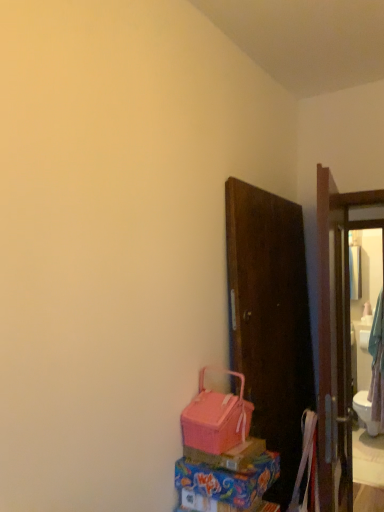
Measure the distance between point (246, 469) and camera.

Point (246, 469) is 4.40 feet away from camera.

This screenshot has height=512, width=384. Describe the element at coordinates (229, 455) in the screenshot. I see `pink plastic box at lower center, arranged as the second box when ordered from the bottom` at that location.

What is the approximate width of matte glass mirror at right?

matte glass mirror at right is 9.33 inches in width.

You are a GUI agent. You are given a task and a screenshot of the screen. Output one action in this format:
    pyautogui.click(x=<x>, y=<y>)
    Task: Click on the matte pink plastic box at lower center, which is the second box in top-to-bottom order
    The width and height of the screenshot is (384, 512).
    Given the screenshot: What is the action you would take?
    pyautogui.click(x=229, y=479)

Considering the positions of objects matte glass mirror at right and pink fabric basket at lower center in the image provided, who is more to the right, matte glass mirror at right or pink fabric basket at lower center?

matte glass mirror at right.

Which of these two, matte glass mirror at right or pink fabric basket at lower center, is smaller?

Smaller between the two is pink fabric basket at lower center.

Considering the sizes of matte glass mirror at right and pink fabric basket at lower center in the image, is matte glass mirror at right wider or thinner than pink fabric basket at lower center?

In the image, matte glass mirror at right appears to be wider than pink fabric basket at lower center.

Considering the points (374, 364) and (219, 401), which point is in front, point (374, 364) or point (219, 401)?

The point (219, 401) is closer to the camera.

Which box is the 1st one when counting from the left side of the matte glass mirror at right? Please provide its 2D coordinates.

[(229, 479)]

From a real-world perspective, which object stands above the other?

matte glass mirror at right.

Does matte pink plastic box at lower center, which ranks as the 1th box in bottom-to-top order, have a greater height compared to matte glass mirror at right?

No.

Considering the sizes of objects matte glass mirror at right and pink plastic box at lower center, arranged as the 1th box when viewed from the top, in the image provided, who is thinner, matte glass mirror at right or pink plastic box at lower center, arranged as the 1th box when viewed from the top,?

Thinner between the two is pink plastic box at lower center, arranged as the 1th box when viewed from the top.

Can you tell me how much matte glass mirror at right and pink plastic box at lower center, arranged as the 1th box when viewed from the top, differ in facing direction?

The angular difference between matte glass mirror at right and pink plastic box at lower center, arranged as the 1th box when viewed from the top, is 87.9 degrees.

Considering the relative sizes of matte glass mirror at right and pink plastic box at lower center, arranged as the 1th box when viewed from the top, in the image provided, is matte glass mirror at right bigger than pink plastic box at lower center, arranged as the 1th box when viewed from the top,?

Yes, matte glass mirror at right is bigger than pink plastic box at lower center, arranged as the 1th box when viewed from the top.

Where is `mirror positioned vertically above the matte pink plastic box at lower center, which ranks as the 1th box in bottom-to-top order (from a real-world perspective)`? This screenshot has height=512, width=384. mirror positioned vertically above the matte pink plastic box at lower center, which ranks as the 1th box in bottom-to-top order (from a real-world perspective) is located at coordinates (367, 351).

Looking at this image, how different are the orientations of matte glass mirror at right and matte pink plastic box at lower center, which is the second box in top-to-bottom order, in degrees?

There is a 89.1-degree angle between the facing directions of matte glass mirror at right and matte pink plastic box at lower center, which is the second box in top-to-bottom order.

Between point (354, 379) and point (267, 469), which one is positioned behind?

The point (354, 379) is more distant.

From the image's perspective, relative to matte pink plastic box at lower center, which ranks as the 1th box in bottom-to-top order, is matte glass mirror at right above or below?

From the image's perspective, matte glass mirror at right appears below matte pink plastic box at lower center, which ranks as the 1th box in bottom-to-top order.

Is pink plastic box at lower center, arranged as the 1th box when viewed from the top, positioned beyond the bounds of matte pink plastic box at lower center, which ranks as the 1th box in bottom-to-top order?

Absolutely, pink plastic box at lower center, arranged as the 1th box when viewed from the top, is external to matte pink plastic box at lower center, which ranks as the 1th box in bottom-to-top order.

Who is bigger, pink plastic box at lower center, arranged as the 1th box when viewed from the top, or matte pink plastic box at lower center, which ranks as the 1th box in bottom-to-top order?

matte pink plastic box at lower center, which ranks as the 1th box in bottom-to-top order.

Is pink plastic box at lower center, arranged as the second box when ordered from the bottom, positioned behind matte pink plastic box at lower center, which is the second box in top-to-bottom order?

Yes, it is behind matte pink plastic box at lower center, which is the second box in top-to-bottom order.

Does point (214, 457) come in front of point (259, 459)?

That is True.

Can you confirm if matte pink plastic box at lower center, which is the second box in top-to-bottom order, is thinner than pink plastic box at lower center, arranged as the second box when ordered from the bottom?

No, matte pink plastic box at lower center, which is the second box in top-to-bottom order, is not thinner than pink plastic box at lower center, arranged as the second box when ordered from the bottom.

Is matte pink plastic box at lower center, which is the second box in top-to-bottom order, closer to camera compared to pink plastic box at lower center, arranged as the 1th box when viewed from the top?

Yes.

Considering the positions of objects matte pink plastic box at lower center, which ranks as the 1th box in bottom-to-top order, and pink plastic box at lower center, arranged as the 1th box when viewed from the top, in the image provided, who is more to the right, matte pink plastic box at lower center, which ranks as the 1th box in bottom-to-top order, or pink plastic box at lower center, arranged as the 1th box when viewed from the top,?

matte pink plastic box at lower center, which ranks as the 1th box in bottom-to-top order.

Could you tell me if matte pink plastic box at lower center, which ranks as the 1th box in bottom-to-top order, is facing pink fabric basket at lower center?

No, matte pink plastic box at lower center, which ranks as the 1th box in bottom-to-top order, does not turn towards pink fabric basket at lower center.

From the image's perspective, is matte pink plastic box at lower center, which ranks as the 1th box in bottom-to-top order, positioned above or below pink fabric basket at lower center?

Clearly, from the image's perspective, matte pink plastic box at lower center, which ranks as the 1th box in bottom-to-top order, is below pink fabric basket at lower center.

From a real-world perspective, is matte pink plastic box at lower center, which ranks as the 1th box in bottom-to-top order, positioned under pink fabric basket at lower center based on gravity?

Yes, from a real-world perspective, matte pink plastic box at lower center, which ranks as the 1th box in bottom-to-top order, is beneath pink fabric basket at lower center.

Find the location of a particular element. This screenshot has height=512, width=384. luggage located above the matte glass mirror at right (from a real-world perspective) is located at coordinates (216, 417).

The width and height of the screenshot is (384, 512). There is a matte glass mirror at right. Find the location of `the 1st box above it (from the image's perspective)`. the 1st box above it (from the image's perspective) is located at coordinates (229, 479).

When comparing their distances from pink plastic box at lower center, arranged as the 1th box when viewed from the top, does matte pink plastic box at lower center, which is the second box in top-to-bottom order, or matte glass mirror at right seem further?

Among the two, matte glass mirror at right is located further to pink plastic box at lower center, arranged as the 1th box when viewed from the top.

When comparing their distances from matte glass mirror at right, does matte pink plastic box at lower center, which ranks as the 1th box in bottom-to-top order, or pink fabric basket at lower center seem further?

Based on the image, matte pink plastic box at lower center, which ranks as the 1th box in bottom-to-top order, appears to be further to matte glass mirror at right.

Which object lies further to the anchor point matte pink plastic box at lower center, which ranks as the 1th box in bottom-to-top order, matte glass mirror at right or pink plastic box at lower center, arranged as the second box when ordered from the bottom?

Based on the image, matte glass mirror at right appears to be further to matte pink plastic box at lower center, which ranks as the 1th box in bottom-to-top order.

Based on their spatial positions, is matte glass mirror at right or pink fabric basket at lower center further from matte pink plastic box at lower center, which is the second box in top-to-bottom order?

matte glass mirror at right.

When comparing their distances from matte glass mirror at right, does pink plastic box at lower center, arranged as the second box when ordered from the bottom, or pink fabric basket at lower center seem closer?

The object closer to matte glass mirror at right is pink fabric basket at lower center.

Estimate the real-world distances between objects in this image. Which object is closer to matte glass mirror at right, pink fabric basket at lower center or matte pink plastic box at lower center, which is the second box in top-to-bottom order?

pink fabric basket at lower center is positioned closer to the anchor matte glass mirror at right.

Based on their spatial positions, is pink plastic box at lower center, arranged as the second box when ordered from the bottom, or matte glass mirror at right closer to matte pink plastic box at lower center, which ranks as the 1th box in bottom-to-top order?

Based on the image, pink plastic box at lower center, arranged as the second box when ordered from the bottom, appears to be nearer to matte pink plastic box at lower center, which ranks as the 1th box in bottom-to-top order.

From the image, which object appears to be nearer to pink fabric basket at lower center, pink plastic box at lower center, arranged as the 1th box when viewed from the top, or matte glass mirror at right?

Based on the image, pink plastic box at lower center, arranged as the 1th box when viewed from the top, appears to be nearer to pink fabric basket at lower center.

At what (x,y) coordinates should I click in order to perform the action: click on box positioned between matte pink plastic box at lower center, which ranks as the 1th box in bottom-to-top order, and matte glass mirror at right from near to far. Please return your answer as a coordinate pair (x, y). The width and height of the screenshot is (384, 512). Looking at the image, I should click on [x=229, y=455].

Locate an element on the screen. The image size is (384, 512). box that lies between pink fabric basket at lower center and matte pink plastic box at lower center, which ranks as the 1th box in bottom-to-top order, from top to bottom is located at coordinates point(229,455).

At what (x,y) coordinates should I click in order to perform the action: click on luggage between matte pink plastic box at lower center, which is the second box in top-to-bottom order, and matte glass mirror at right in the front-back direction. Please return your answer as a coordinate pair (x, y). The image size is (384, 512). Looking at the image, I should click on (216, 417).

Locate an element on the screen. box between pink fabric basket at lower center and matte glass mirror at right in the front-back direction is located at coordinates (229, 455).